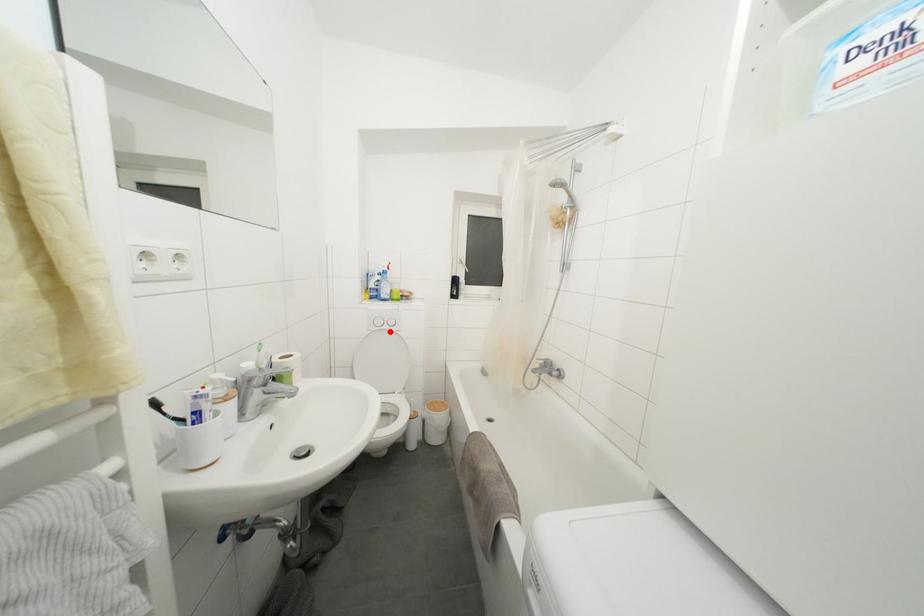
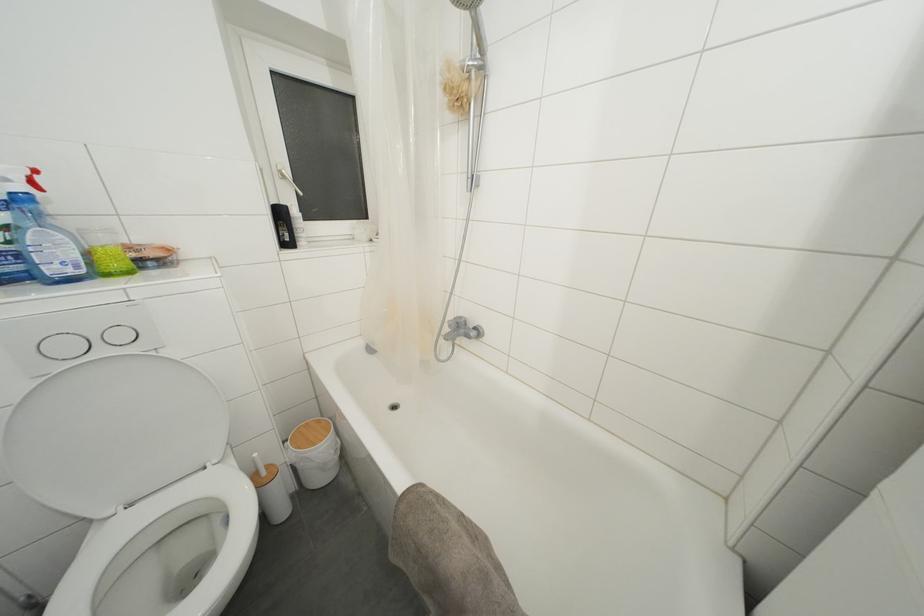
Locate, in the second image, the point that corresponds to the highlighted location in the first image.

(106, 357)